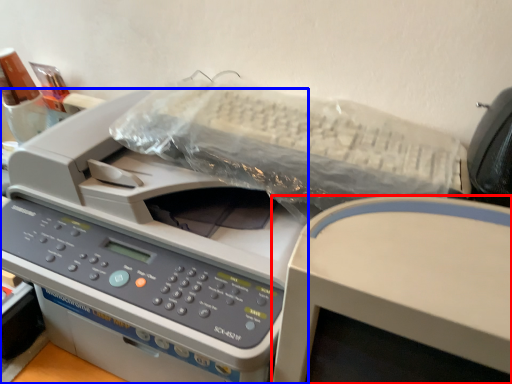
Question: Which object is closer to the camera taking this photo, office supplies (highlighted by a red box) or printer (highlighted by a blue box)?

Choices:
 (A) office supplies
 (B) printer

Answer: (A)